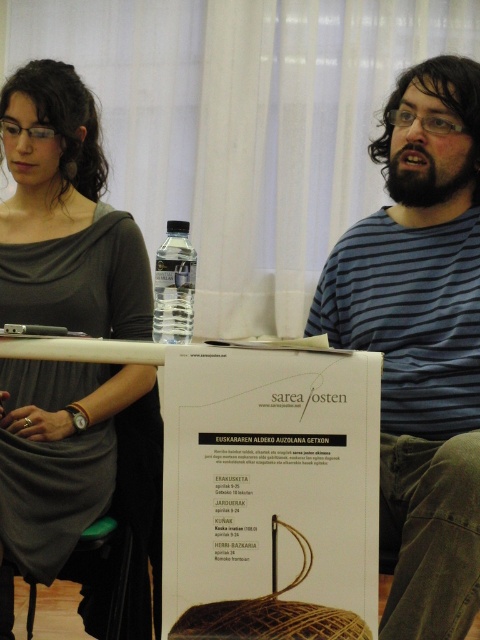
Question: Which point is farther to the camera?

Choices:
 (A) blue striped shirt at center
 (B) white paper poster at center
 (C) matte gray dress at upper left

Answer: (C)

Question: Which object is farther from the camera taking this photo?

Choices:
 (A) white paper poster at center
 (B) blue striped shirt at center
 (C) matte gray dress at upper left

Answer: (C)

Question: Does white paper poster at center have a larger size compared to matte gray dress at upper left?

Choices:
 (A) no
 (B) yes

Answer: (A)

Question: Does blue striped shirt at center lie behind white paper poster at center?

Choices:
 (A) yes
 (B) no

Answer: (A)

Question: Considering the real-world distances, which object is farthest from the blue striped shirt at center?

Choices:
 (A) matte gray dress at upper left
 (B) white paper poster at center

Answer: (A)

Question: Can you confirm if blue striped shirt at center is smaller than white paper poster at center?

Choices:
 (A) yes
 (B) no

Answer: (B)